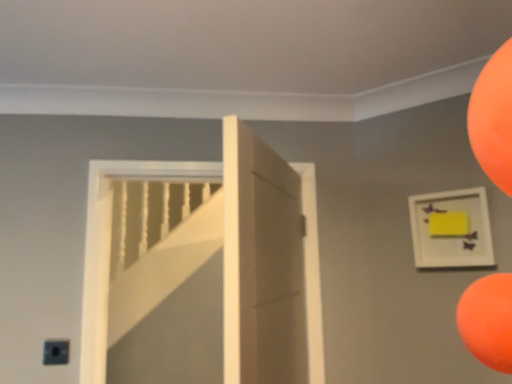
Question: From the image's perspective, is yellow matte picture frame at upper right positioned above or below white matte door at center?

Choices:
 (A) above
 (B) below

Answer: (A)

Question: Does point (417, 263) appear closer or farther from the camera than point (249, 329)?

Choices:
 (A) farther
 (B) closer

Answer: (A)

Question: From a real-world perspective, is yellow matte picture frame at upper right physically located above or below white matte door at center?

Choices:
 (A) above
 (B) below

Answer: (A)

Question: In terms of width, does white matte door at center look wider or thinner when compared to yellow matte picture frame at upper right?

Choices:
 (A) thin
 (B) wide

Answer: (B)

Question: In the image, is white matte door at center positioned in front of or behind yellow matte picture frame at upper right?

Choices:
 (A) behind
 (B) front

Answer: (B)

Question: Based on their positions, is white matte door at center located to the left or right of yellow matte picture frame at upper right?

Choices:
 (A) right
 (B) left

Answer: (B)

Question: From a real-world perspective, relative to yellow matte picture frame at upper right, is white matte door at center vertically above or below?

Choices:
 (A) above
 (B) below

Answer: (B)